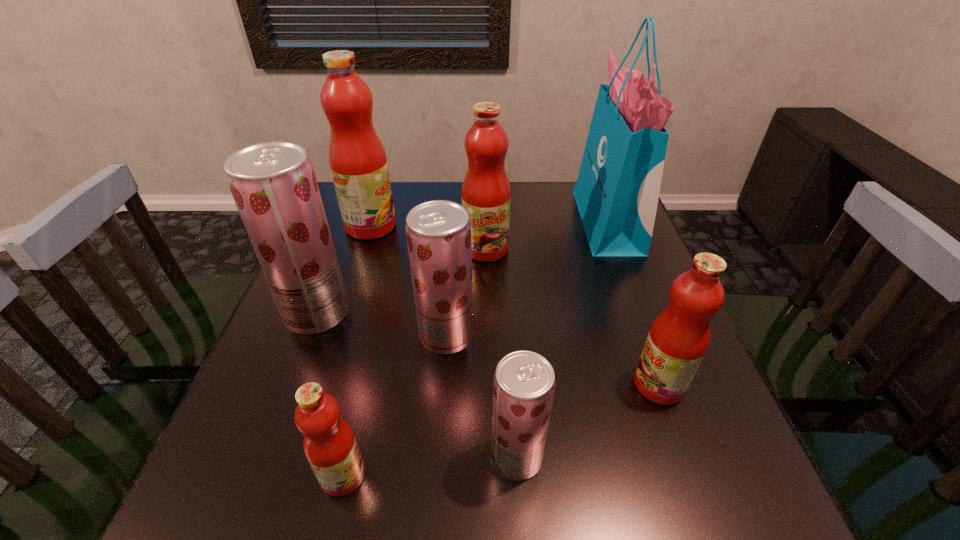
Identify the location of free space located 0.310m on the left of the blue shopping bag. This screenshot has height=540, width=960. (473, 221).

In order to click on free space located on the front label of the tallest fruit juice in this screenshot , I will do `click(471, 226)`.

Locate an element on the screen. This screenshot has height=540, width=960. free space located 0.350m on the front of the biggest strawberry fruit juice is located at coordinates (240, 513).

I want to click on vacant area situated 0.110m on the front label of the third pink fruit juice from left to right, so click(x=487, y=293).

Locate an element on the screen. Image resolution: width=960 pixels, height=540 pixels. vacant space situated 0.310m on the front of the second smallest strawberry fruit juice is located at coordinates (432, 522).

Find the location of a particular element. The height and width of the screenshot is (540, 960). free space located on the front label of the second nearest pink fruit juice is located at coordinates (518, 384).

What are the coordinates of `free space located 0.160m on the front label of the second nearest pink fruit juice` in the screenshot? It's located at (550, 384).

Find the location of a particular element. This screenshot has height=540, width=960. free spot located on the front label of the second nearest pink fruit juice is located at coordinates (602, 384).

Where is `vacant position located 0.100m on the front label of the smallest pink fruit juice`? This screenshot has height=540, width=960. vacant position located 0.100m on the front label of the smallest pink fruit juice is located at coordinates (427, 475).

The image size is (960, 540). I want to click on vacant point located on the right of the rightmost strawberry fruit juice, so click(657, 456).